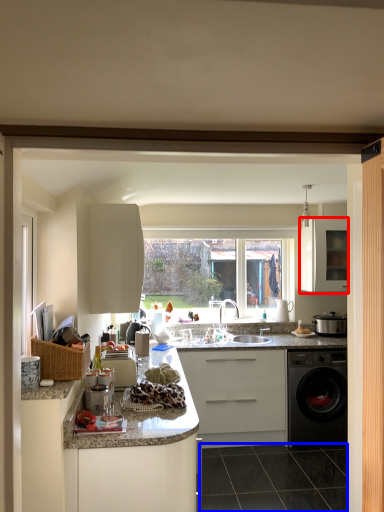
Question: Among these objects, which one is nearest to the camera, cabinetry (highlighted by a red box) or tile (highlighted by a blue box)?

Choices:
 (A) cabinetry
 (B) tile

Answer: (B)